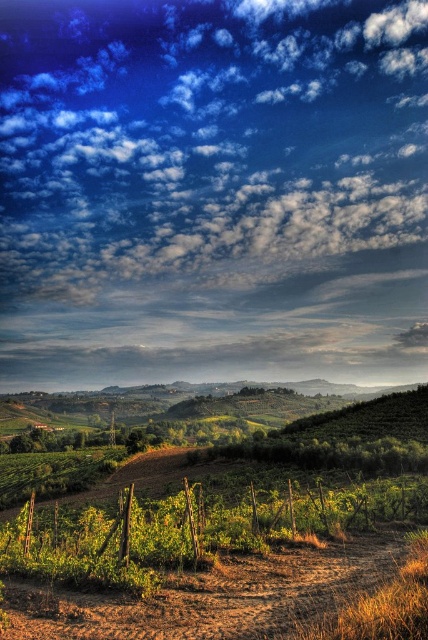
Is cloudy sky at upper center positioned at the back of green wire fence at lower center?

Yes, cloudy sky at upper center is further from the viewer.

Where is `cloudy sky at upper center`? The width and height of the screenshot is (428, 640). cloudy sky at upper center is located at coordinates (213, 189).

Identify the location of cloudy sky at upper center. (213, 189).